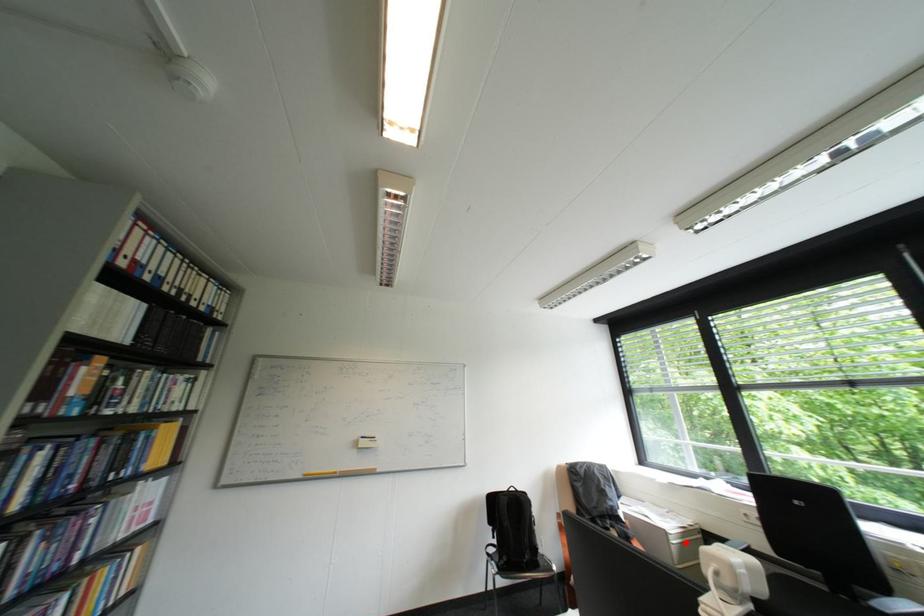
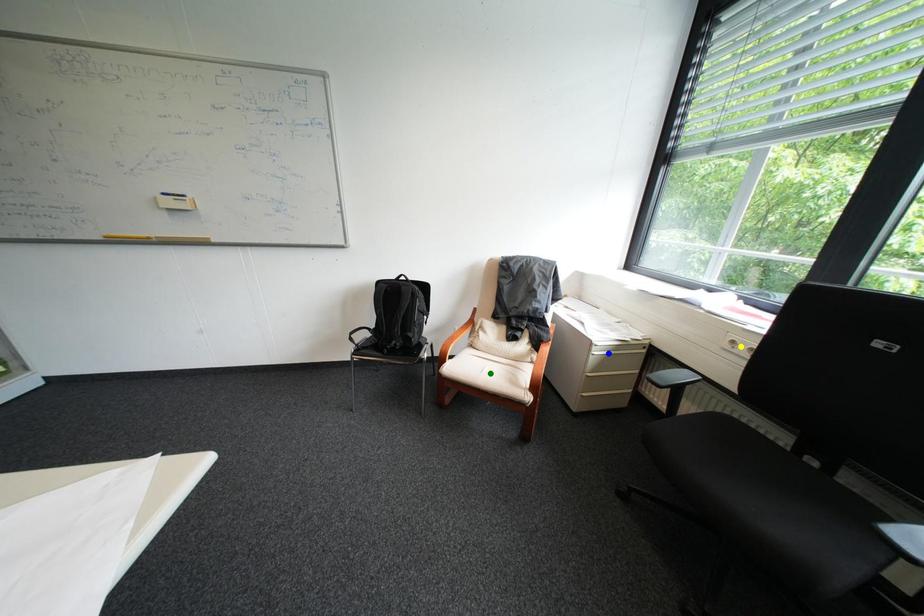
Question: I am providing you with two images of the same scene from different viewpoints. A red point is marked on the first image. You are given multiple points on the second image. Which spot in image 2 lines up with the point in image 1?

Choices:
 (A) yellow point
 (B) blue point
 (C) green point

Answer: (B)